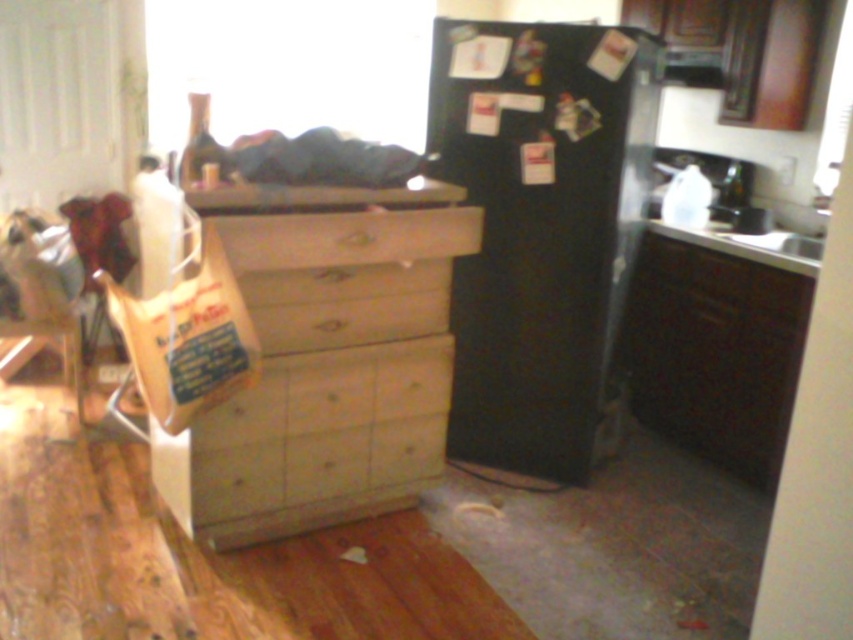
Question: Among these points, which one is nearest to the camera?

Choices:
 (A) (386, 396)
 (B) (328, 253)

Answer: (B)

Question: Is black matte refrigerator at center to the left of light wood dresser at center from the viewer's perspective?

Choices:
 (A) no
 (B) yes

Answer: (A)

Question: Can you confirm if black matte refrigerator at center is thinner than matte wood dresser at lower right?

Choices:
 (A) yes
 (B) no

Answer: (B)

Question: Which point is closer to the camera taking this photo?

Choices:
 (A) (415, 225)
 (B) (721, 260)
 (C) (438, 22)

Answer: (A)

Question: Among these objects, which one is nearest to the camera?

Choices:
 (A) matte wood dresser at lower right
 (B) black matte refrigerator at center

Answer: (B)

Question: Does black matte refrigerator at center appear on the left side of matte wood dresser at lower right?

Choices:
 (A) yes
 (B) no

Answer: (A)